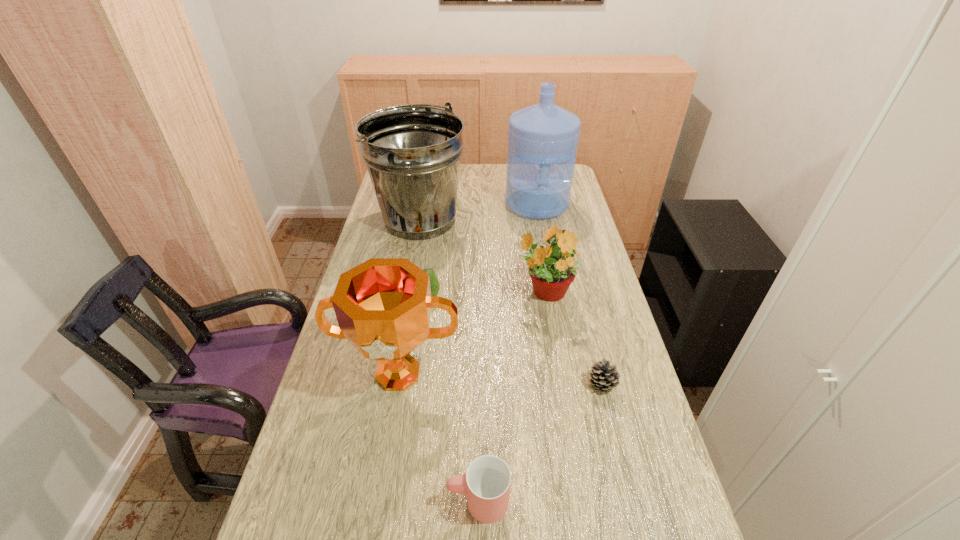
Identify the location of vacant space located on the back of the flowerpot. This screenshot has width=960, height=540. (538, 253).

At what (x,y) coordinates should I click in order to perform the action: click on blank space located on the front of the avocado. Please return your answer as a coordinate pair (x, y). The image size is (960, 540). Looking at the image, I should click on (415, 407).

Find the location of a particular element. vacant point located 0.050m on the side of the nearest object with the handle is located at coordinates (424, 501).

At what (x,y) coordinates should I click in order to perform the action: click on free space located 0.100m on the side of the nearest object with the handle. Please return your answer as a coordinate pair (x, y). The image size is (960, 540). Looking at the image, I should click on click(x=400, y=501).

Find the location of a particular element. The height and width of the screenshot is (540, 960). vacant space positioned on the side of the nearest object with the handle is located at coordinates (420, 501).

You are a GUI agent. You are given a task and a screenshot of the screen. Output one action in this format:
    pyautogui.click(x=<x>, y=<y>)
    Task: Click on the vacant space located on the left of the shortest object
    This screenshot has height=540, width=960.
    Given the screenshot: What is the action you would take?
    pyautogui.click(x=554, y=384)

You are a GUI agent. You are given a task and a screenshot of the screen. Output one action in this format:
    pyautogui.click(x=<x>, y=<y>)
    Task: Click on the object located at the far edge
    Image resolution: width=960 pixels, height=540 pixels.
    Given the screenshot: What is the action you would take?
    pyautogui.click(x=543, y=138)

Locate an element on the screen. This screenshot has height=540, width=960. bucket situated at the left edge is located at coordinates (412, 152).

Locate an element on the screen. Image resolution: width=960 pixels, height=540 pixels. award present at the left edge is located at coordinates (383, 306).

The width and height of the screenshot is (960, 540). Identify the location of water jug present at the right edge. (543, 138).